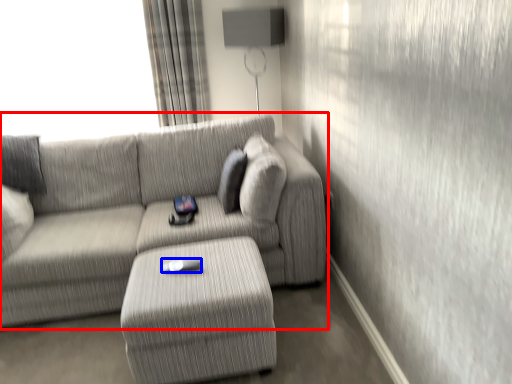
Question: Which of the following is the closest to the observer, studio couch (highlighted by a red box) or Wii controller (highlighted by a blue box)?

Choices:
 (A) studio couch
 (B) Wii controller

Answer: (A)